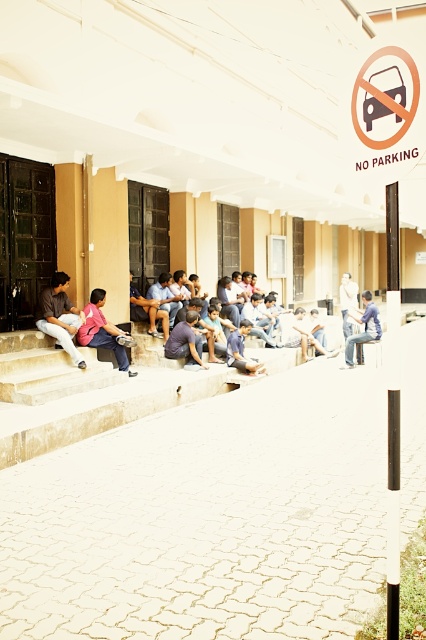
You are a delivery person trying to place a package between the matte brown shirt at lower left and the pink fabric shirt at lower left. The package is 50 centimeters long. Can you fit the package between them?

The distance between the matte brown shirt at lower left and the pink fabric shirt at lower left is 48.61 centimeters. Since the package is 50 centimeters long, it cannot fit between them as the space is smaller than the package.

You are a photographer trying to capture a group photo of the individuals sitting on the steps. You notice the matte brown shirt at lower left and the pink fabric shirt at lower left. Which shirt should you focus on to ensure it appears more detailed in the photo?

The matte brown shirt at lower left is thinner than the pink fabric shirt at lower left, so focusing on the matte brown shirt at lower left would allow it to appear more detailed in the photo since thinner fabrics can show more texture when in focus.

You are standing at the base of the steps looking up towards the building. There are two points marked on the ground in front of you. The first point is at coordinates point [37,310] and the second is at point [104,344]. Which point is closer to your current position?

Point [37,310] is closer to the camera than point [104,344], so the first point is closer to your current position.